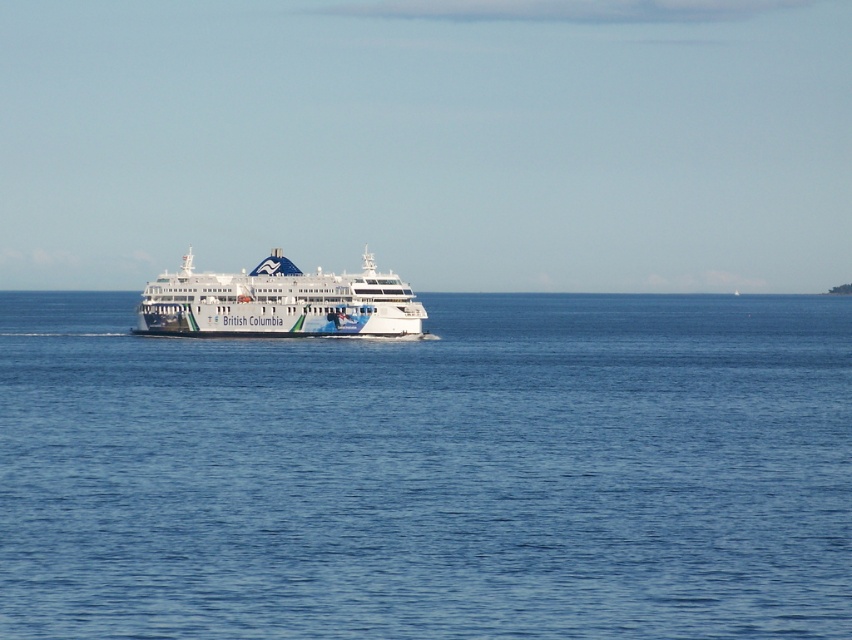
Question: Among these points, which one is nearest to the camera?

Choices:
 (A) (180, 273)
 (B) (19, 508)

Answer: (B)

Question: Is blue liquid water at center positioned at the back of white glossy ferry at center?

Choices:
 (A) no
 (B) yes

Answer: (A)

Question: Does blue liquid water at center appear under white glossy ferry at center?

Choices:
 (A) yes
 (B) no

Answer: (A)

Question: Does blue liquid water at center have a lesser width compared to white glossy ferry at center?

Choices:
 (A) yes
 (B) no

Answer: (B)